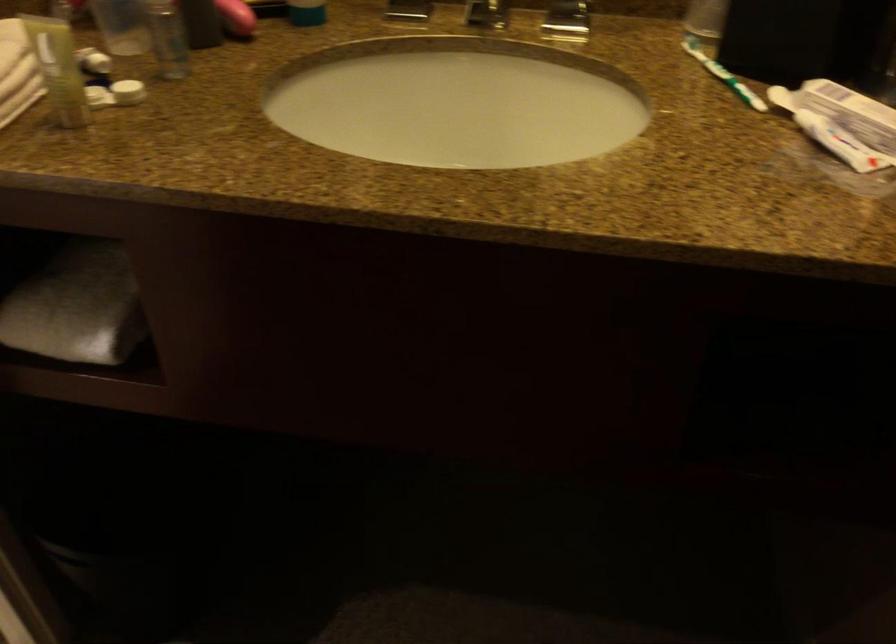
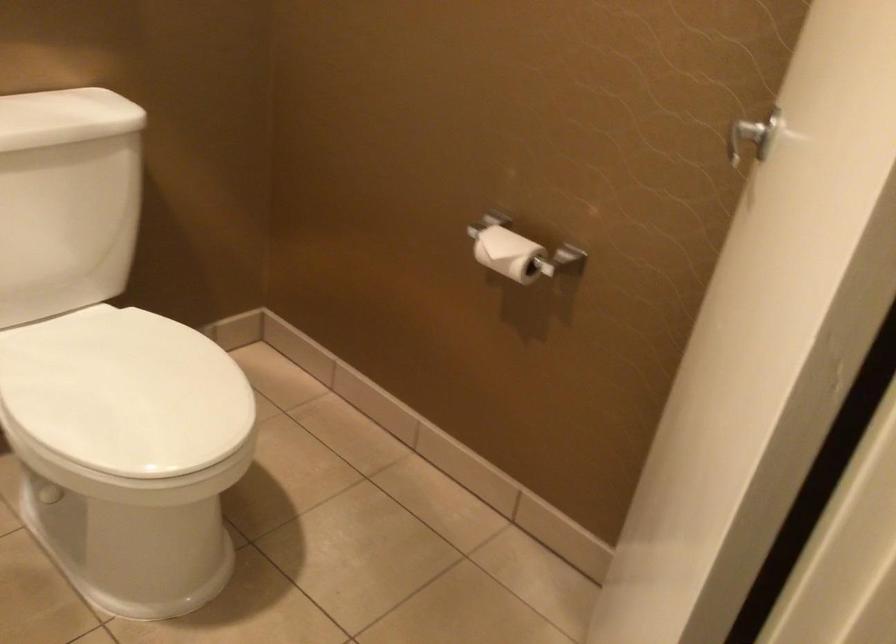
Question: The images are taken continuously from a first-person perspective. In which direction is your viewpoint rotating?

Choices:
 (A) Left
 (B) Right
 (C) Up
 (D) Down

Answer: (A)